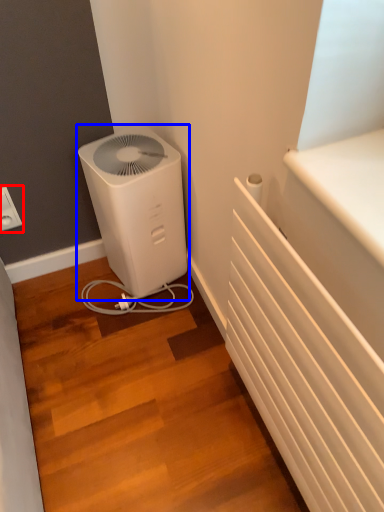
Question: Which object appears farthest to the camera in this image, electric outlet (highlighted by a red box) or home appliance (highlighted by a blue box)?

Choices:
 (A) electric outlet
 (B) home appliance

Answer: (A)